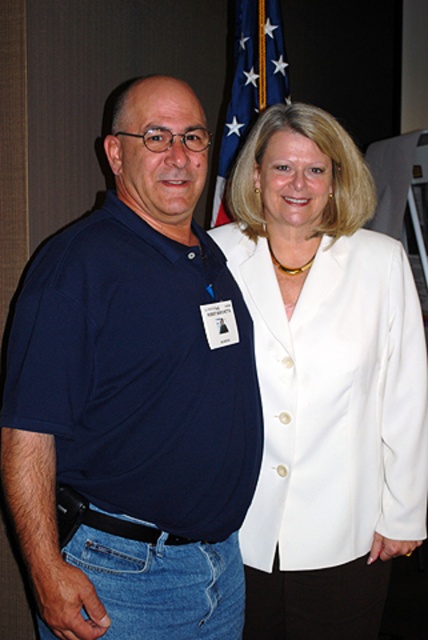
You are standing in the same room as the two people and the white matte blazer at center. If you want to touch the blazer without moving your feet, which direction should you face?

The white matte blazer at center is located at point 0.595 on the horizontal axis and 0.759 on the vertical axis. Since the coordinates are relative to the image frame, facing towards the center area where the blazer is placed would allow you to reach it without moving your feet.

You are a photographer at a formal event and need to capture a photo where the white matte blazer at center is visible without being blocked by the blue fabric flag at upper center. Can you adjust your angle to ensure the blazer is fully visible?

The white matte blazer at center is positioned under the blue fabric flag at upper center. To ensure the blazer is fully visible, you can lower your camera angle slightly so the flag does not block the view of the blazer.

In the scene shown: You are attending a formal event and notice the matte blue shirt at center and the blue fabric flag at upper center. Which object is located higher in the image?

The blue fabric flag at upper center is higher because it is positioned above the matte blue shirt at center.